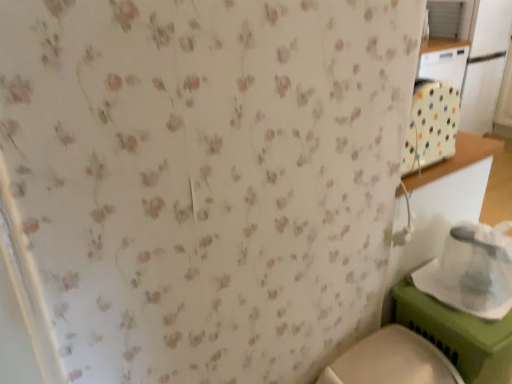
Question: From the image's perspective, is white plastic container at lower right under white glossy toilet at lower right?

Choices:
 (A) no
 (B) yes

Answer: (A)

Question: Is white plastic container at lower right in front of white glossy toilet at lower right?

Choices:
 (A) no
 (B) yes

Answer: (A)

Question: Is white plastic container at lower right bigger than white glossy toilet at lower right?

Choices:
 (A) no
 (B) yes

Answer: (A)

Question: Is white plastic container at lower right wider than white glossy toilet at lower right?

Choices:
 (A) no
 (B) yes

Answer: (A)

Question: Does white plastic container at lower right lie behind white glossy toilet at lower right?

Choices:
 (A) yes
 (B) no

Answer: (A)

Question: Considering the relative sizes of white plastic container at lower right and white glossy toilet at lower right in the image provided, is white plastic container at lower right shorter than white glossy toilet at lower right?

Choices:
 (A) yes
 (B) no

Answer: (A)

Question: Does white glossy toilet at lower right have a smaller size compared to white plastic container at lower right?

Choices:
 (A) yes
 (B) no

Answer: (B)

Question: Is white glossy toilet at lower right further to camera compared to white plastic container at lower right?

Choices:
 (A) yes
 (B) no

Answer: (B)

Question: Can you confirm if white glossy toilet at lower right is wider than white plastic container at lower right?

Choices:
 (A) no
 (B) yes

Answer: (B)

Question: Is white glossy toilet at lower right facing towards white plastic container at lower right?

Choices:
 (A) yes
 (B) no

Answer: (B)

Question: Can you confirm if white glossy toilet at lower right is positioned to the left of white plastic container at lower right?

Choices:
 (A) yes
 (B) no

Answer: (A)

Question: From the image's perspective, is white glossy toilet at lower right above white plastic container at lower right?

Choices:
 (A) yes
 (B) no

Answer: (B)

Question: Is white glossy toilet at lower right to the left or to the right of white plastic container at lower right in the image?

Choices:
 (A) left
 (B) right

Answer: (A)